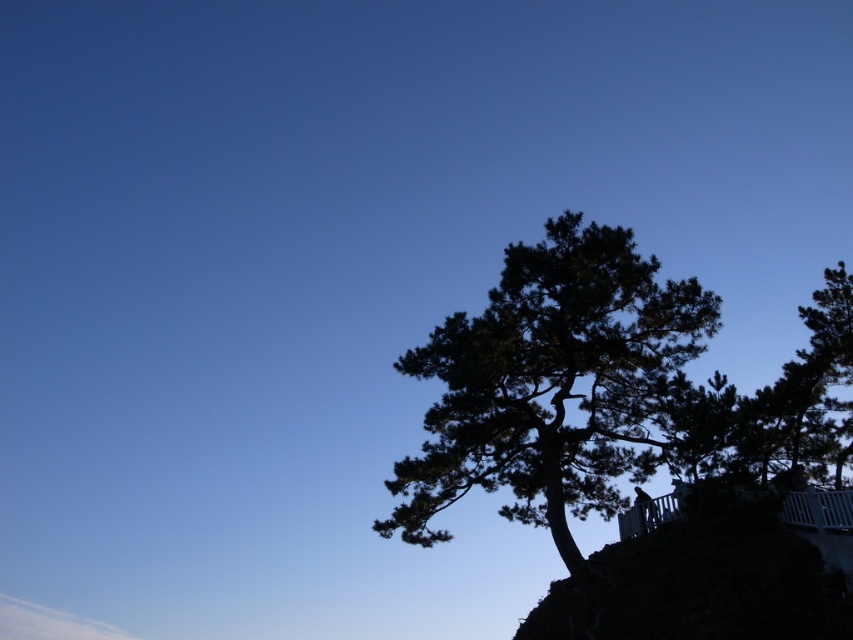
Question: Where is dark green textured tree at center located in relation to dark green textured tree at upper right in the image?

Choices:
 (A) above
 (B) below

Answer: (B)

Question: Which point is closer to the camera?

Choices:
 (A) dark green textured tree at center
 (B) dark green textured tree at upper right

Answer: (B)

Question: Is dark green textured tree at center further to camera compared to dark green textured tree at upper right?

Choices:
 (A) no
 (B) yes

Answer: (B)

Question: Among these objects, which one is nearest to the camera?

Choices:
 (A) dark green textured tree at upper right
 (B) dark green textured tree at center

Answer: (A)

Question: Observing the image, what is the correct spatial positioning of dark green textured tree at center in reference to dark green textured tree at upper right?

Choices:
 (A) above
 (B) below

Answer: (B)